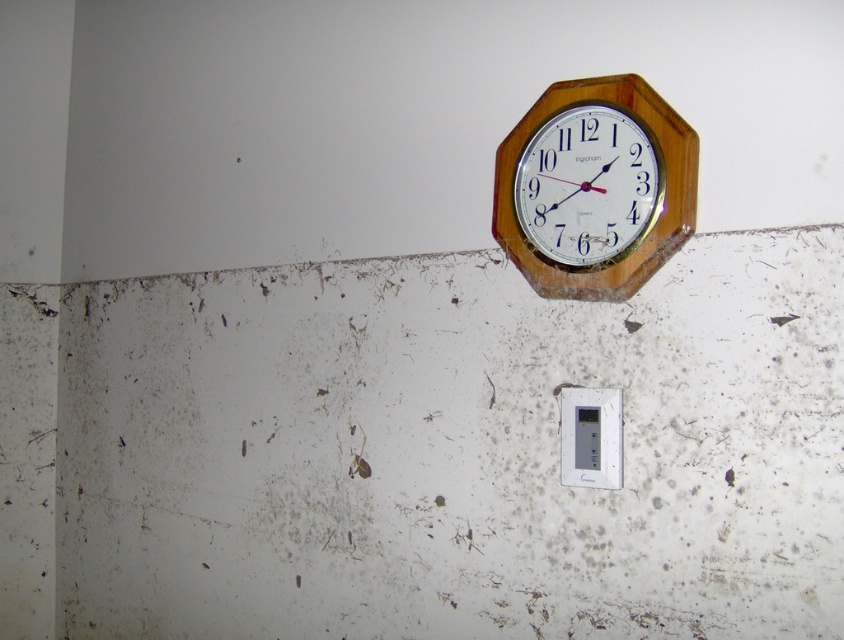
Question: Among these points, which one is farthest from the camera?

Choices:
 (A) (564, 433)
 (B) (540, 138)

Answer: (B)

Question: Does wooden clock at upper right appear on the right side of white plastic electric outlet at center?

Choices:
 (A) no
 (B) yes

Answer: (A)

Question: Which point is closer to the camera?

Choices:
 (A) white plastic electric outlet at center
 (B) wooden clock at upper right

Answer: (B)

Question: Is wooden clock at upper right behind white plastic electric outlet at center?

Choices:
 (A) yes
 (B) no

Answer: (B)

Question: Can you confirm if wooden clock at upper right is positioned to the left of white plastic electric outlet at center?

Choices:
 (A) no
 (B) yes

Answer: (B)